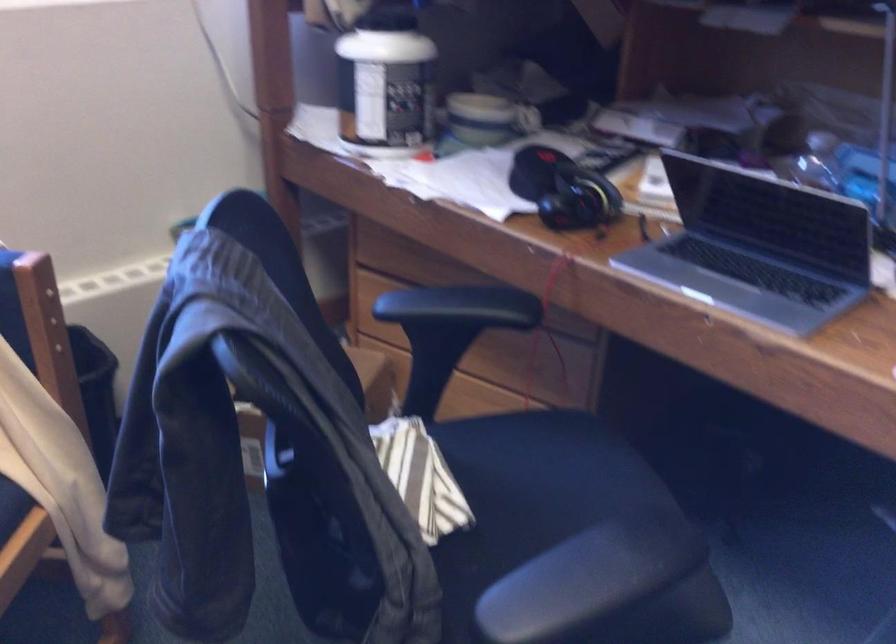
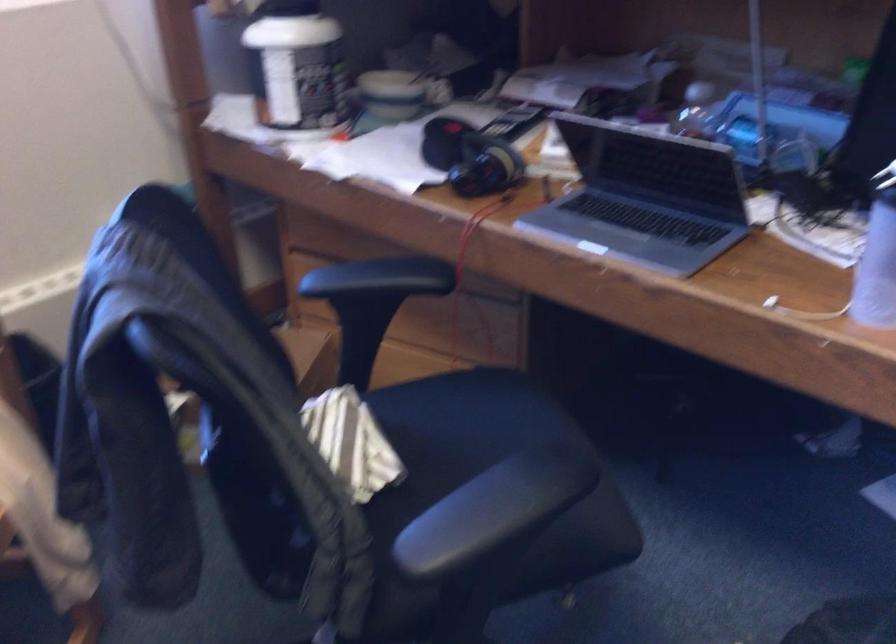
Where in the second image is the point corresponding to point 388,79 from the first image?

(297, 67)